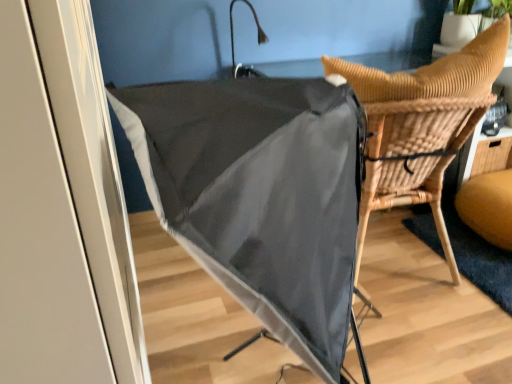
Describe the element at coordinates (485, 153) in the screenshot. I see `woven wood table at right` at that location.

Image resolution: width=512 pixels, height=384 pixels. What are the coordinates of `woven wood chair at center` in the screenshot? It's located at (421, 125).

Does matte black umbrella at center lie behind woven wood table at right?

No.

From the image's perspective, which object appears higher, matte black umbrella at center or woven wood table at right?

woven wood table at right.

Based on the photo, which of these two, matte black umbrella at center or woven wood table at right, stands taller?

matte black umbrella at center is taller.

Considering the relative positions of matte black umbrella at center and woven wood table at right in the image provided, is matte black umbrella at center to the right of woven wood table at right from the viewer's perspective?

In fact, matte black umbrella at center is to the left of woven wood table at right.

From the image's perspective, is woven wood table at right positioned above or below woven wood chair at center?

Based on their image positions, woven wood table at right is located above woven wood chair at center.

In the scene shown: Which point is more forward, (508, 150) or (474, 122)?

Point (474, 122)

Does woven wood table at right have a lesser width compared to woven wood chair at center?

Yes, woven wood table at right is thinner than woven wood chair at center.

Which is correct: woven wood table at right is inside woven wood chair at center, or outside of it?

woven wood table at right is outside woven wood chair at center.

From a real-world perspective, is matte black umbrella at center located higher than woven wood chair at center?

Yes, from a real-world perspective, matte black umbrella at center is on top of woven wood chair at center.

Locate an element on the screen. umbrella in front of the woven wood chair at center is located at coordinates (260, 195).

Can you confirm if matte black umbrella at center is smaller than woven wood chair at center?

Actually, matte black umbrella at center might be larger than woven wood chair at center.

Is matte black umbrella at center in front of or behind woven wood chair at center in the image?

Visually, matte black umbrella at center is located in front of woven wood chair at center.

Is woven wood table at right not near matte black umbrella at center?

Yes, woven wood table at right is far from matte black umbrella at center.

Which of these two, woven wood table at right or matte black umbrella at center, is smaller?

woven wood table at right.

Considering the positions of objects woven wood table at right and matte black umbrella at center in the image provided, who is behind, woven wood table at right or matte black umbrella at center?

woven wood table at right is further from the camera.

Considering the sizes of objects woven wood chair at center and matte black umbrella at center in the image provided, who is bigger, woven wood chair at center or matte black umbrella at center?

matte black umbrella at center is bigger.

Is woven wood chair at center oriented towards matte black umbrella at center?

No, woven wood chair at center is not oriented towards matte black umbrella at center.

From the image's perspective, who appears lower, woven wood chair at center or matte black umbrella at center?

matte black umbrella at center is shown below in the image.

Can you confirm if woven wood chair at center is thinner than matte black umbrella at center?

Yes, woven wood chair at center is thinner than matte black umbrella at center.

Does woven wood chair at center have a lesser width compared to woven wood table at right?

Incorrect, the width of woven wood chair at center is not less than that of woven wood table at right.

From a real-world perspective, relative to woven wood table at right, is woven wood chair at center vertically above or below?

From a real-world perspective, woven wood chair at center is physically above woven wood table at right.

Is woven wood chair at center located outside woven wood table at right?

That's correct, woven wood chair at center is outside of woven wood table at right.

Considering the sizes of woven wood chair at center and woven wood table at right in the image, is woven wood chair at center bigger or smaller than woven wood table at right?

Clearly, woven wood chair at center is larger in size than woven wood table at right.

Image resolution: width=512 pixels, height=384 pixels. I want to click on table below the matte black umbrella at center (from a real-world perspective), so click(485, 153).

Where is `table that is on the right side of woven wood chair at center`? table that is on the right side of woven wood chair at center is located at coordinates (485, 153).

When comparing their distances from woven wood chair at center, does woven wood table at right or matte black umbrella at center seem further?

woven wood table at right is further to woven wood chair at center.

From the image, which object appears to be farther from woven wood chair at center, matte black umbrella at center or woven wood table at right?

Among the two, woven wood table at right is located further to woven wood chair at center.

Based on the photo, considering their positions, is woven wood chair at center positioned further to matte black umbrella at center than woven wood table at right?

Among the two, woven wood table at right is located further to matte black umbrella at center.

Estimate the real-world distances between objects in this image. Which object is further from matte black umbrella at center, woven wood table at right or woven wood chair at center?

woven wood table at right.

Looking at the image, which one is located further to woven wood table at right, matte black umbrella at center or woven wood chair at center?

Among the two, matte black umbrella at center is located further to woven wood table at right.

Considering their positions, is woven wood chair at center positioned closer to woven wood table at right than matte black umbrella at center?

Based on the image, woven wood chair at center appears to be nearer to woven wood table at right.

Where is `chair positioned between matte black umbrella at center and woven wood table at right from near to far`? Image resolution: width=512 pixels, height=384 pixels. chair positioned between matte black umbrella at center and woven wood table at right from near to far is located at coordinates (421, 125).